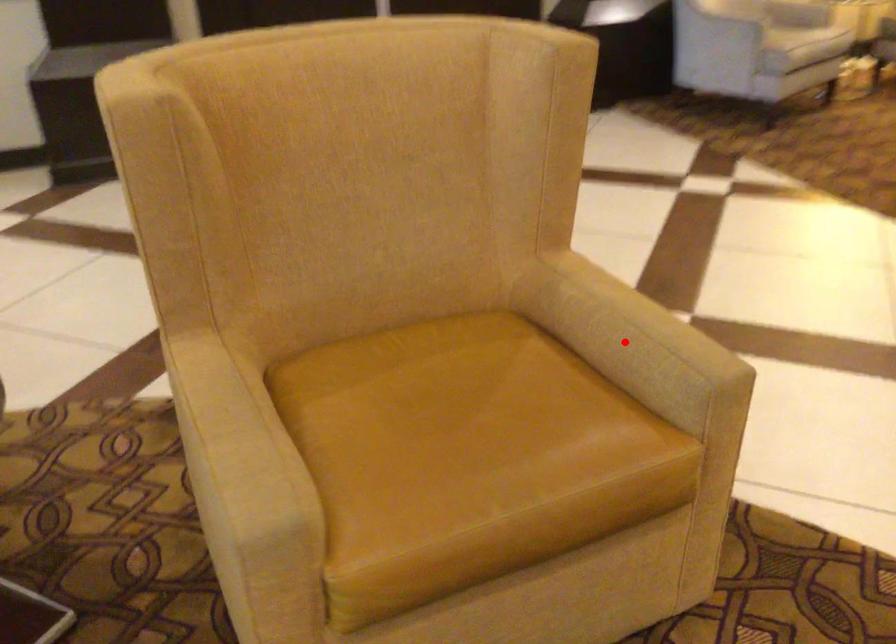
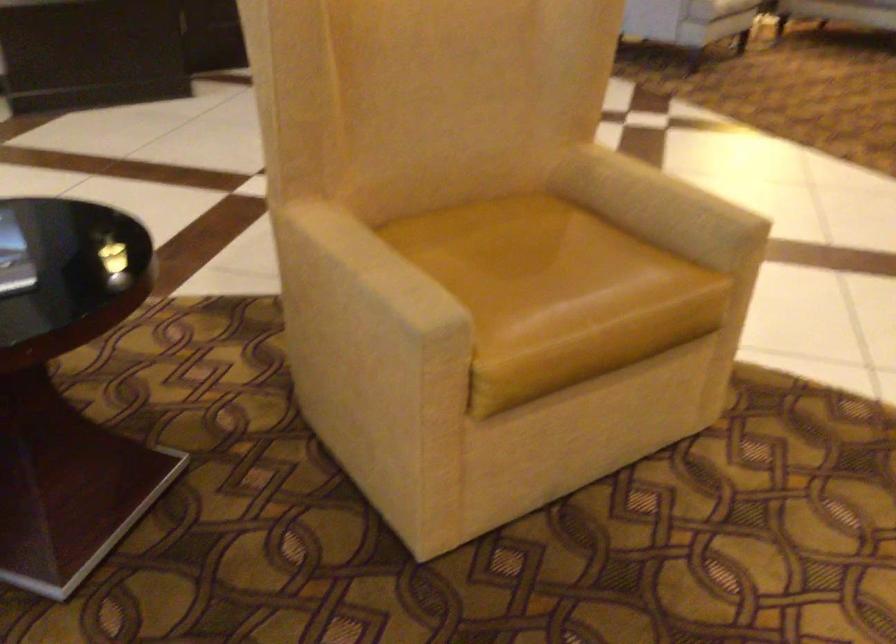
In the second image, find the point that corresponds to the highlighted location in the first image.

(659, 205)